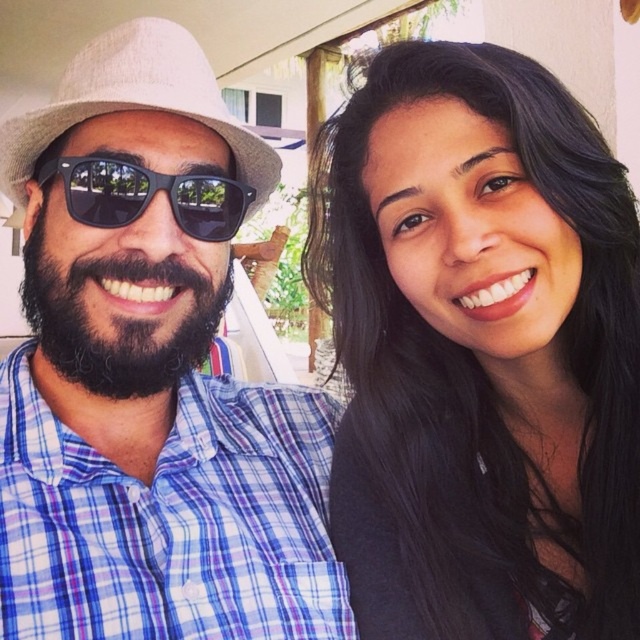
Question: Can you confirm if plaid cotton shirt at left is positioned above beige straw fedora at left?

Choices:
 (A) no
 (B) yes

Answer: (A)

Question: Is beige straw fedora at left behind dark brown thick beard at center?

Choices:
 (A) yes
 (B) no

Answer: (B)

Question: Where is plaid cotton shirt at left located in relation to beige straw fedora at left in the image?

Choices:
 (A) left
 (B) right

Answer: (B)

Question: Which object appears farthest from the camera in this image?

Choices:
 (A) black hair at upper right
 (B) black matte sunglasses at left
 (C) beige straw fedora at left

Answer: (B)

Question: Which is nearer to the dark brown thick beard at center?

Choices:
 (A) black matte sunglasses at left
 (B) beige straw fedora at left
 (C) black hair at upper right
 (D) plaid cotton shirt at left

Answer: (D)

Question: Which of the following is the farthest from the observer?

Choices:
 (A) plaid cotton shirt at left
 (B) black matte sunglasses at left

Answer: (B)